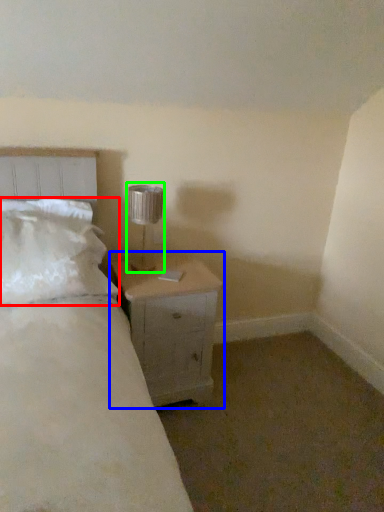
Question: Considering the real-world distances, which object is farthest from pillow (highlighted by a red box)? nightstand (highlighted by a blue box) or lamp (highlighted by a green box)?

Choices:
 (A) nightstand
 (B) lamp

Answer: (B)